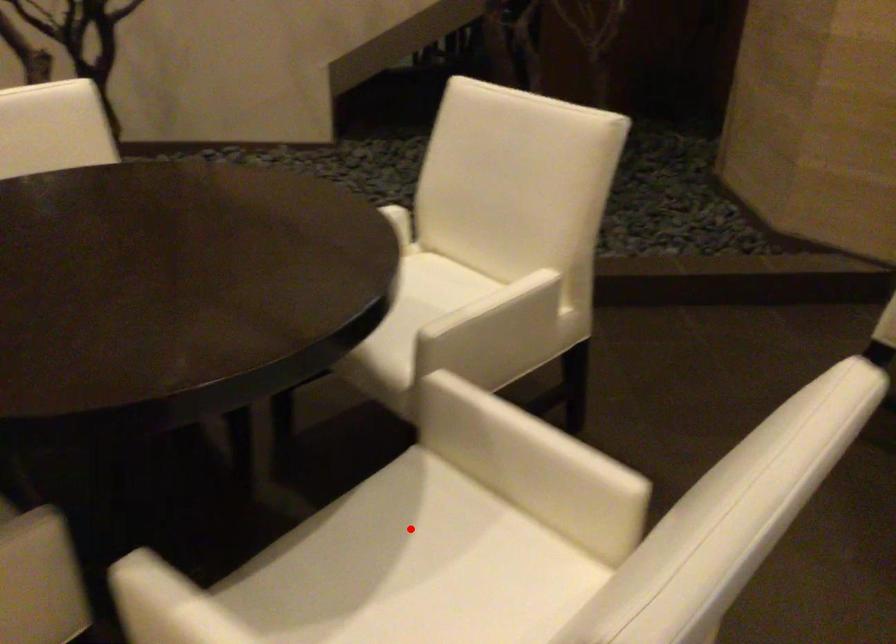
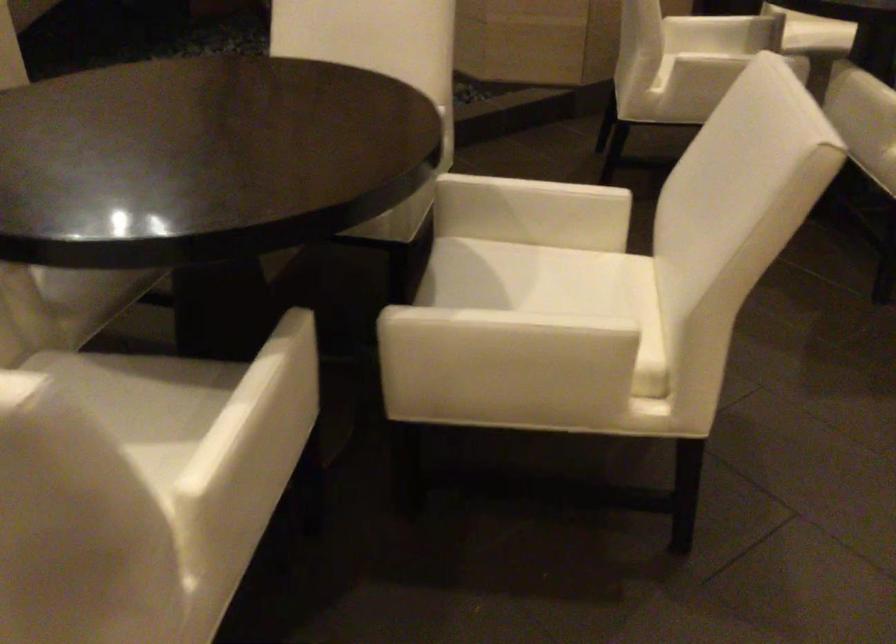
Question: A red point is marked in image1. In image2, is the corresponding 3D point closer to the camera or farther? Reply with the corresponding letter.

Choices:
 (A) The corresponding 3D point is closer.
 (B) The corresponding 3D point is farther.

Answer: (B)